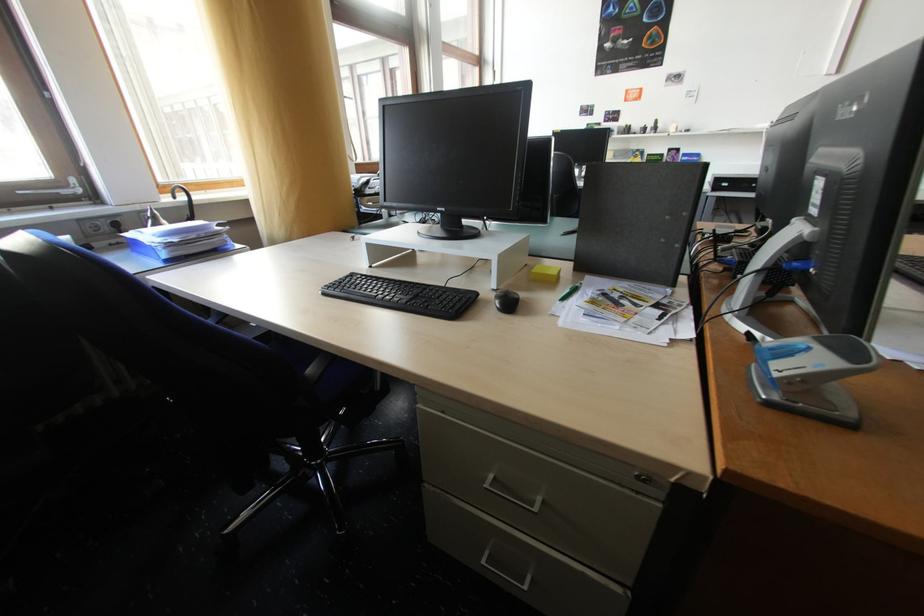
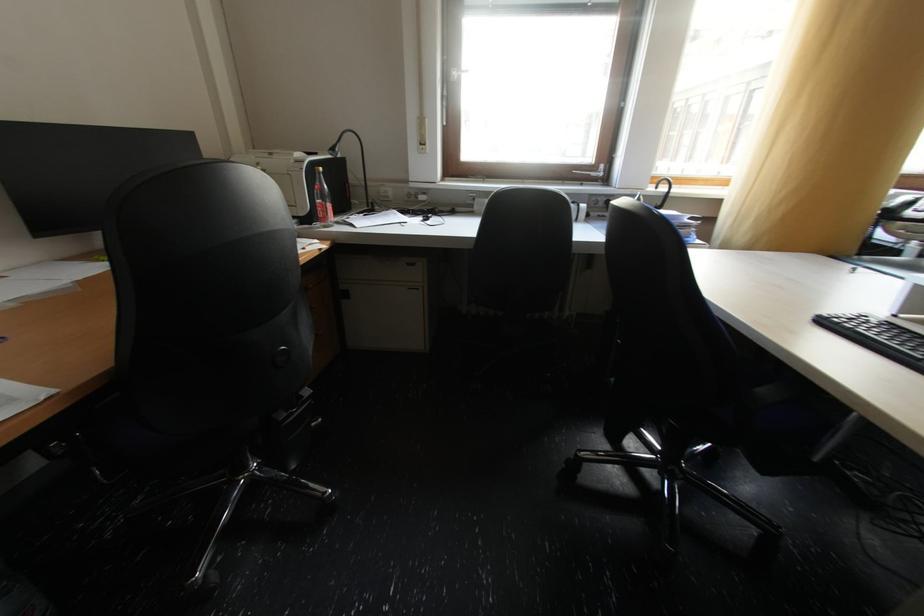
Question: The camera is either moving clockwise (left) or counter-clockwise (right) around the object. The first image is from the beginning of the video and the second image is from the end. Is the camera moving left or right when shooting the video?

Choices:
 (A) Left
 (B) Right

Answer: (B)